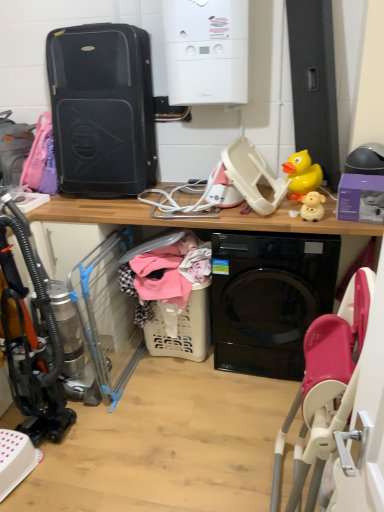
Question: From the image's perspective, is black hard shell suitcase at upper left over yellow rubber duck at upper right, acting as the first toy starting from the back?

Choices:
 (A) yes
 (B) no

Answer: (A)

Question: Does black hard shell suitcase at upper left appear on the left side of yellow rubber duck at upper right, the second toy positioned from the front?

Choices:
 (A) yes
 (B) no

Answer: (A)

Question: Is yellow rubber duck at upper right, the second toy positioned from the front, at the back of black hard shell suitcase at upper left?

Choices:
 (A) no
 (B) yes

Answer: (A)

Question: Are black hard shell suitcase at upper left and yellow rubber duck at upper right, the 2th toy ordered from the bottom, far apart?

Choices:
 (A) yes
 (B) no

Answer: (B)

Question: From a real-world perspective, is black hard shell suitcase at upper left below yellow rubber duck at upper right, the first toy viewed from the top?

Choices:
 (A) no
 (B) yes

Answer: (A)

Question: From a real-world perspective, is black hard shell suitcase at upper left above or below white matte boiler at upper center?

Choices:
 (A) below
 (B) above

Answer: (A)

Question: Considering the relative positions of black hard shell suitcase at upper left and white matte boiler at upper center in the image provided, is black hard shell suitcase at upper left to the left or to the right of white matte boiler at upper center?

Choices:
 (A) left
 (B) right

Answer: (A)

Question: Relative to white matte boiler at upper center, is black hard shell suitcase at upper left in front or behind?

Choices:
 (A) front
 (B) behind

Answer: (B)

Question: In terms of width, does black hard shell suitcase at upper left look wider or thinner when compared to white matte boiler at upper center?

Choices:
 (A) thin
 (B) wide

Answer: (B)

Question: Does point (299, 194) appear closer or farther from the camera than point (304, 206)?

Choices:
 (A) closer
 (B) farther

Answer: (B)

Question: In terms of height, does yellow rubber duck at upper right, acting as the first toy starting from the back, look taller or shorter compared to white matte sheep at upper right, placed as the second toy when sorted from top to bottom?

Choices:
 (A) tall
 (B) short

Answer: (A)

Question: Is yellow rubber duck at upper right, the second toy positioned from the front, to the left or to the right of white matte sheep at upper right, placed as the second toy when sorted from top to bottom, in the image?

Choices:
 (A) left
 (B) right

Answer: (B)

Question: Considering the positions of yellow rubber duck at upper right, acting as the first toy starting from the back, and white matte sheep at upper right, the 1th toy in the bottom-to-top sequence, in the image, is yellow rubber duck at upper right, acting as the first toy starting from the back, wider or thinner than white matte sheep at upper right, the 1th toy in the bottom-to-top sequence,?

Choices:
 (A) wide
 (B) thin

Answer: (A)

Question: Based on their sizes in the image, would you say white matte sheep at upper right, placed as the second toy when sorted from top to bottom, is bigger or smaller than black glossy washing machine at center?

Choices:
 (A) small
 (B) big

Answer: (A)

Question: Would you say white matte sheep at upper right, placed as the second toy when sorted from top to bottom, is to the left or to the right of black glossy washing machine at center in the picture?

Choices:
 (A) left
 (B) right

Answer: (B)